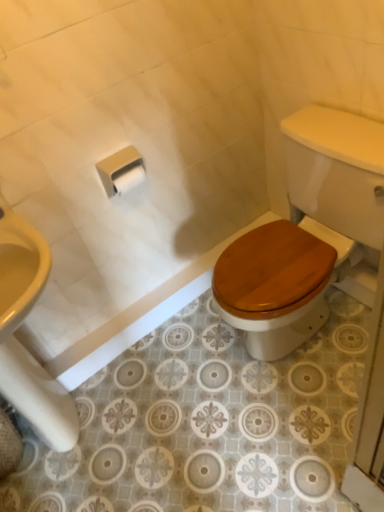
The width and height of the screenshot is (384, 512). Describe the element at coordinates (121, 170) in the screenshot. I see `white matte toilet paper at center, positioned as the second toilet paper in back-to-front order` at that location.

How much space does white matte toilet paper at center, marked as the 1th toilet paper in a front-to-back arrangement, occupy vertically?

It is 6.23 inches.

Image resolution: width=384 pixels, height=512 pixels. Find the location of `white matte toilet paper at upper center, which appears as the second toilet paper when viewed from the front`. white matte toilet paper at upper center, which appears as the second toilet paper when viewed from the front is located at coordinates (128, 178).

How much space does white matte toilet paper at upper center, which appears as the second toilet paper when viewed from the front, occupy vertically?

The height of white matte toilet paper at upper center, which appears as the second toilet paper when viewed from the front, is 3.61 inches.

Identify the location of white matte toilet paper at center, positioned as the second toilet paper in back-to-front order. The height and width of the screenshot is (512, 384). (121, 170).

Does point (115, 184) come closer to viewer compared to point (134, 185)?

That is True.

From the image's perspective, is white matte toilet paper at center, marked as the 1th toilet paper in a front-to-back arrangement, on top of white matte toilet paper at upper center, which appears as the second toilet paper when viewed from the front?

Yes, from the image's perspective, white matte toilet paper at center, marked as the 1th toilet paper in a front-to-back arrangement, is above white matte toilet paper at upper center, which appears as the second toilet paper when viewed from the front.

From a real-world perspective, who is located lower, white matte toilet paper at center, positioned as the second toilet paper in back-to-front order, or white matte toilet paper at upper center, which appears as the second toilet paper when viewed from the front?

white matte toilet paper at upper center, which appears as the second toilet paper when viewed from the front, from a real-world perspective.

Would you say white matte toilet paper at center, marked as the 1th toilet paper in a front-to-back arrangement, contains white matte toilet paper at upper center, which appears as the second toilet paper when viewed from the front?

Yes, white matte toilet paper at upper center, which appears as the second toilet paper when viewed from the front, can be found within white matte toilet paper at center, marked as the 1th toilet paper in a front-to-back arrangement.

From the image's perspective, is wooden at lower right on white matte toilet paper at upper center, which appears as the second toilet paper when viewed from the front?

Incorrect, from the image's perspective, wooden at lower right is lower than white matte toilet paper at upper center, which appears as the second toilet paper when viewed from the front.

Which is farther, (336, 246) or (138, 184)?

The point (336, 246) is behind.

Based on their sizes in the image, would you say wooden at lower right is bigger or smaller than white matte toilet paper at upper center, which appears as the second toilet paper when viewed from the front?

wooden at lower right is bigger than white matte toilet paper at upper center, which appears as the second toilet paper when viewed from the front.

From a real-world perspective, which toilet paper is the 1st one above the wooden at lower right? Please provide its 2D coordinates.

[(128, 178)]

Based on the photo, in terms of width, does white matte toilet paper at upper center, which is counted as the first toilet paper, starting from the back, look wider or thinner when compared to wooden at lower right?

In the image, white matte toilet paper at upper center, which is counted as the first toilet paper, starting from the back, appears to be more narrow than wooden at lower right.

How far apart are white matte toilet paper at upper center, which is counted as the first toilet paper, starting from the back, and wooden at lower right?

The distance of white matte toilet paper at upper center, which is counted as the first toilet paper, starting from the back, from wooden at lower right is 23.98 inches.

Where is `toilet lying below the white matte toilet paper at upper center, which is counted as the first toilet paper, starting from the back (from the image's perspective)`? The width and height of the screenshot is (384, 512). toilet lying below the white matte toilet paper at upper center, which is counted as the first toilet paper, starting from the back (from the image's perspective) is located at coordinates (306, 231).

Is white matte toilet paper at upper center, which appears as the second toilet paper when viewed from the front, next to wooden at lower right and touching it?

white matte toilet paper at upper center, which appears as the second toilet paper when viewed from the front, and wooden at lower right are not in contact.

Is wooden at lower right surrounding white matte toilet paper at center, positioned as the second toilet paper in back-to-front order?

No, white matte toilet paper at center, positioned as the second toilet paper in back-to-front order, is not a part of wooden at lower right.

From the image's perspective, which one is positioned higher, wooden at lower right or white matte toilet paper at center, marked as the 1th toilet paper in a front-to-back arrangement?

white matte toilet paper at center, marked as the 1th toilet paper in a front-to-back arrangement.

Could you tell me if wooden at lower right is facing white matte toilet paper at center, marked as the 1th toilet paper in a front-to-back arrangement?

No, wooden at lower right is not oriented towards white matte toilet paper at center, marked as the 1th toilet paper in a front-to-back arrangement.

Between point (339, 180) and point (143, 178), which one is positioned in front?

Point (339, 180)

From the image's perspective, is white matte toilet paper at upper center, which is counted as the first toilet paper, starting from the back, positioned above or below white matte toilet paper at center, marked as the 1th toilet paper in a front-to-back arrangement?

white matte toilet paper at upper center, which is counted as the first toilet paper, starting from the back, is below white matte toilet paper at center, marked as the 1th toilet paper in a front-to-back arrangement.

Considering the sizes of objects white matte toilet paper at upper center, which is counted as the first toilet paper, starting from the back, and white matte toilet paper at center, positioned as the second toilet paper in back-to-front order, in the image provided, who is bigger, white matte toilet paper at upper center, which is counted as the first toilet paper, starting from the back, or white matte toilet paper at center, positioned as the second toilet paper in back-to-front order,?

With larger size is white matte toilet paper at center, positioned as the second toilet paper in back-to-front order.

Are white matte toilet paper at upper center, which appears as the second toilet paper when viewed from the front, and white matte toilet paper at center, marked as the 1th toilet paper in a front-to-back arrangement, far apart?

white matte toilet paper at upper center, which appears as the second toilet paper when viewed from the front, is near white matte toilet paper at center, marked as the 1th toilet paper in a front-to-back arrangement, not far away.

Can you tell me how much white matte toilet paper at center, positioned as the second toilet paper in back-to-front order, and wooden at lower right differ in facing direction?

They differ by 87 degrees in their facing directions.

Does point (130, 164) lie behind point (249, 336)?

No, it is in front of (249, 336).

From a real-world perspective, is white matte toilet paper at center, positioned as the second toilet paper in back-to-front order, under wooden at lower right?

No.

Considering the relative positions of white matte toilet paper at center, positioned as the second toilet paper in back-to-front order, and wooden at lower right in the image provided, is white matte toilet paper at center, positioned as the second toilet paper in back-to-front order, behind wooden at lower right?

Yes, white matte toilet paper at center, positioned as the second toilet paper in back-to-front order, is behind wooden at lower right.

The height and width of the screenshot is (512, 384). In order to click on toilet paper that is under the white matte toilet paper at center, positioned as the second toilet paper in back-to-front order (from a real-world perspective) in this screenshot , I will do `click(128, 178)`.

Find the location of a particular element. toilet that is on the right side of white matte toilet paper at upper center, which appears as the second toilet paper when viewed from the front is located at coordinates [306, 231].

Considering their positions, is white matte toilet paper at center, positioned as the second toilet paper in back-to-front order, positioned closer to white matte toilet paper at upper center, which appears as the second toilet paper when viewed from the front, than wooden at lower right?

white matte toilet paper at center, positioned as the second toilet paper in back-to-front order, is positioned closer to the anchor white matte toilet paper at upper center, which appears as the second toilet paper when viewed from the front.

From the image, which object appears to be farther from wooden at lower right, white matte toilet paper at upper center, which is counted as the first toilet paper, starting from the back, or white matte toilet paper at center, positioned as the second toilet paper in back-to-front order?

white matte toilet paper at upper center, which is counted as the first toilet paper, starting from the back, lies further to wooden at lower right than the other object.

Which object lies nearer to the anchor point wooden at lower right, white matte toilet paper at center, positioned as the second toilet paper in back-to-front order, or white matte toilet paper at upper center, which appears as the second toilet paper when viewed from the front?

white matte toilet paper at center, positioned as the second toilet paper in back-to-front order, lies closer to wooden at lower right than the other object.

From the image, which object appears to be nearer to white matte toilet paper at upper center, which appears as the second toilet paper when viewed from the front, wooden at lower right or white matte toilet paper at center, positioned as the second toilet paper in back-to-front order?

Based on the image, white matte toilet paper at center, positioned as the second toilet paper in back-to-front order, appears to be nearer to white matte toilet paper at upper center, which appears as the second toilet paper when viewed from the front.

Based on their spatial positions, is wooden at lower right or white matte toilet paper at upper center, which is counted as the first toilet paper, starting from the back, closer to white matte toilet paper at center, positioned as the second toilet paper in back-to-front order?

The object closer to white matte toilet paper at center, positioned as the second toilet paper in back-to-front order, is white matte toilet paper at upper center, which is counted as the first toilet paper, starting from the back.

Based on the photo, based on their spatial positions, is white matte toilet paper at upper center, which appears as the second toilet paper when viewed from the front, or wooden at lower right closer to white matte toilet paper at center, marked as the 1th toilet paper in a front-to-back arrangement?

white matte toilet paper at upper center, which appears as the second toilet paper when viewed from the front.

Identify the location of toilet paper located between white matte toilet paper at center, positioned as the second toilet paper in back-to-front order, and wooden at lower right in the left-right direction. The image size is (384, 512). (128, 178).